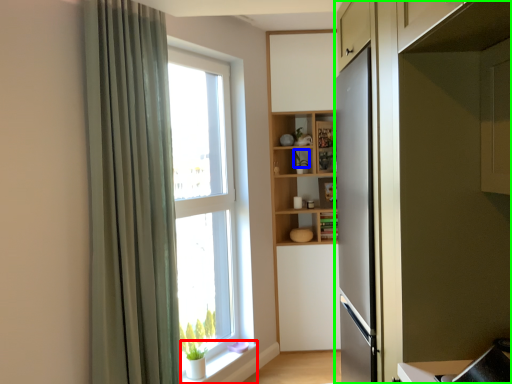
Question: Estimate the real-world distances between objects in this image. Which object is farther from window sill (highlighted by a red box), plant (highlighted by a blue box) or cabinetry (highlighted by a green box)?

Choices:
 (A) plant
 (B) cabinetry

Answer: (B)